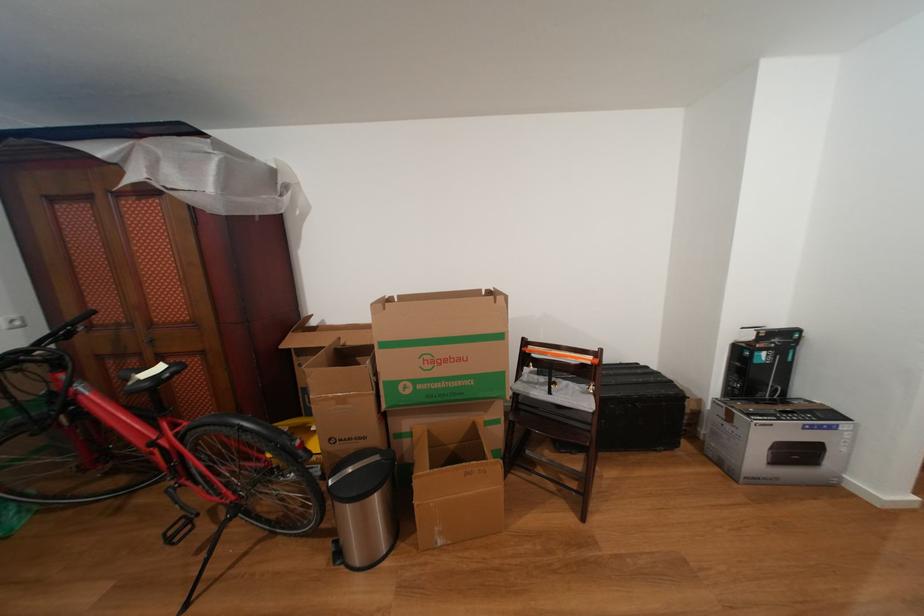
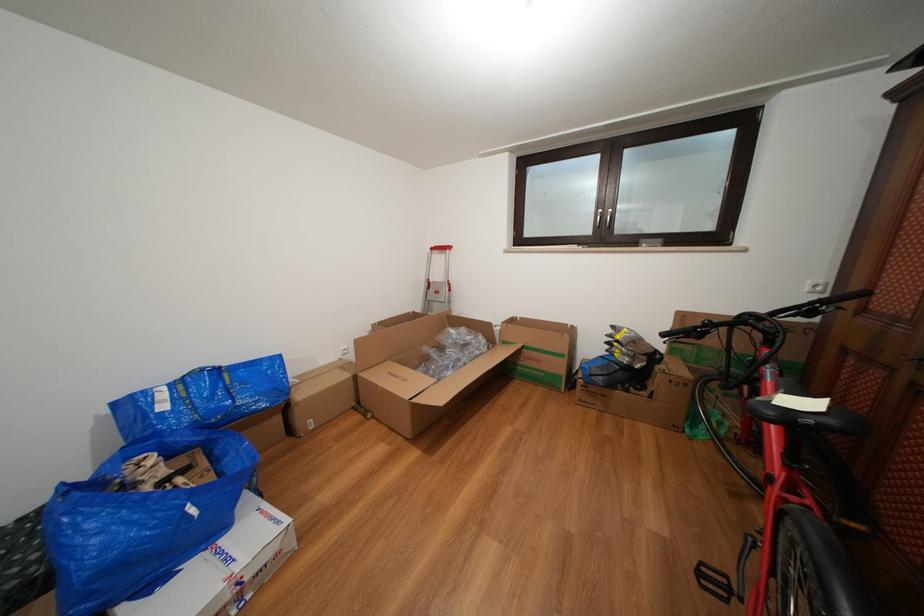
Find the pixel in the second image that matches point 177,546 in the first image.

(708, 578)